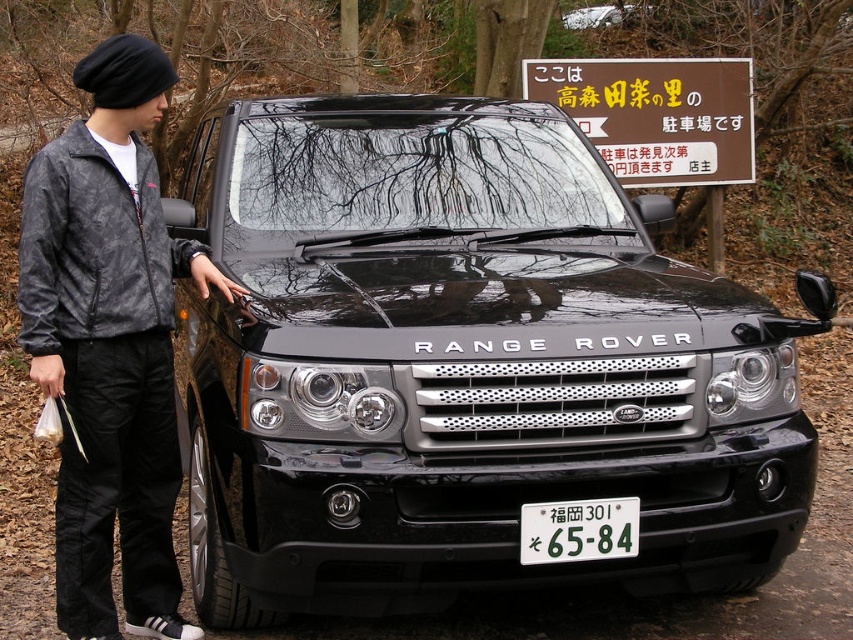
Is white plastic license plate at center shorter than black metallic car at center?

Yes, white plastic license plate at center is shorter than black metallic car at center.

In the scene shown: Measure the distance between white plastic license plate at center and camera.

white plastic license plate at center is 9.00 feet away from camera.

Is point (630, 512) farther from viewer compared to point (633, 12)?

That is False.

Find the location of a particular element. This screenshot has width=853, height=640. white plastic license plate at center is located at coordinates (578, 531).

Does camouflage jacket at left have a larger size compared to black metallic car at center?

Yes.

Can you confirm if camouflage jacket at left is wider than black metallic car at center?

No, camouflage jacket at left is not wider than black metallic car at center.

Locate an element on the screen. This screenshot has height=640, width=853. camouflage jacket at left is located at coordinates (109, 342).

Looking at this image, can you confirm if black metallic range rover at center is positioned to the left of white plastic license plate at center?

A: Indeed, black metallic range rover at center is positioned on the left side of white plastic license plate at center.

Based on the photo, which is more to the right, black metallic range rover at center or white plastic license plate at center?

white plastic license plate at center

Who is more forward, (189, 348) or (606, 554)?

Positioned in front is point (606, 554).

The image size is (853, 640). Identify the location of black metallic range rover at center. (463, 365).